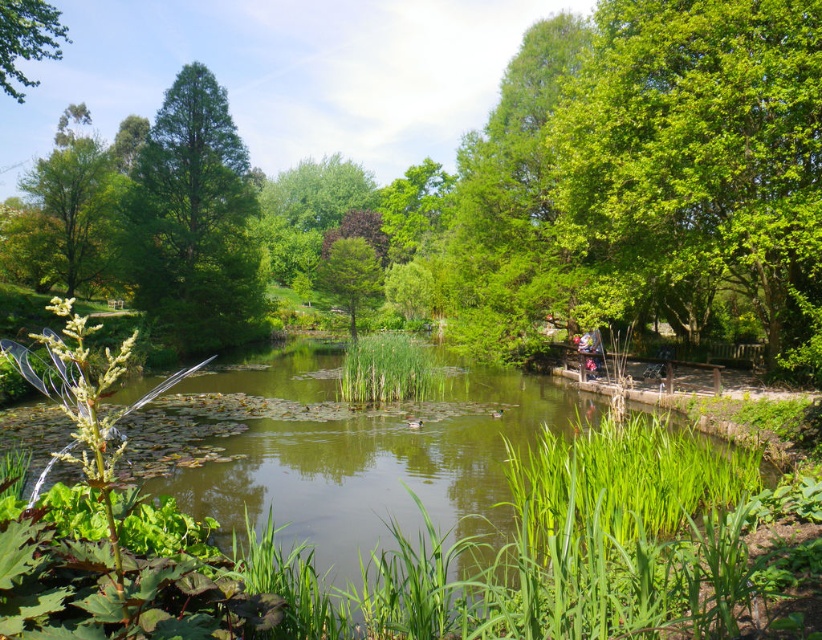
Which is more to the right, green leafy tree at upper left or green matte tree at center?

From the viewer's perspective, green matte tree at center appears more on the right side.

Does green leafy tree at upper left appear on the right side of green matte tree at center?

Incorrect, green leafy tree at upper left is not on the right side of green matte tree at center.

Between point (2, 83) and point (344, 298), which one is positioned in front?

Point (2, 83)

This screenshot has height=640, width=822. I want to click on green leafy tree at upper left, so click(x=26, y=38).

Is point (91, 225) more distant than point (353, 321)?

No.

Who is more distant from viewer, (x=49, y=161) or (x=377, y=292)?

Positioned behind is point (x=377, y=292).

Is point (89, 198) farther from camera compared to point (372, 269)?

That is False.

Identify the location of green leafy tree at left. Image resolution: width=822 pixels, height=640 pixels. (77, 204).

In the scene shown: Can you confirm if green grassy river at center is wider than green glossy tree at upper left?

Yes.

Who is taller, green grassy river at center or green glossy tree at upper left?

Standing taller between the two is green glossy tree at upper left.

Is point (54, 579) positioned after point (243, 186)?

No.

Find the location of a particular element. green grassy river at center is located at coordinates (390, 557).